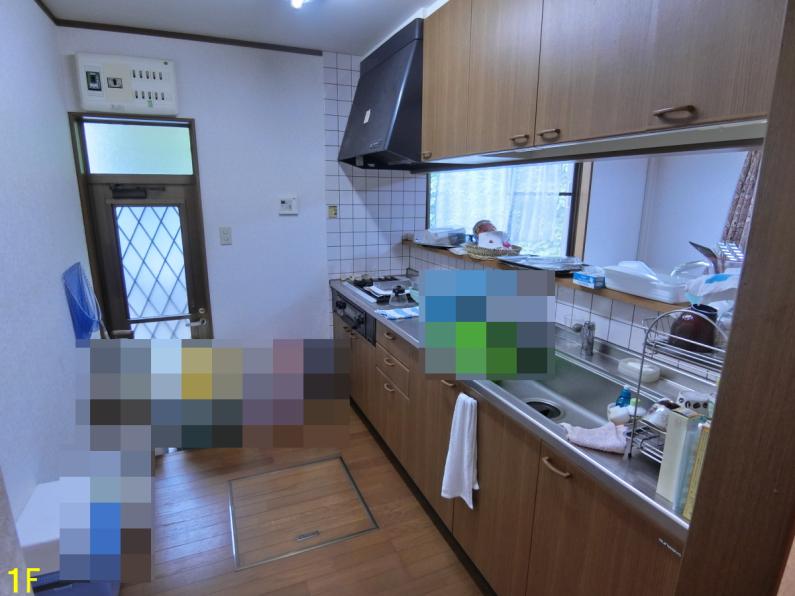
I want to click on dish towels, so click(591, 433), click(467, 434).